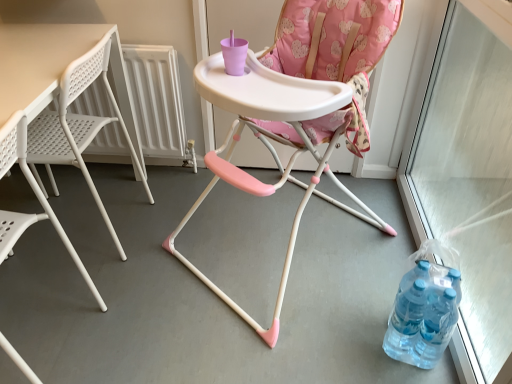
Question: In terms of size, does white plastic table at left appear bigger or smaller than white plastic radiator at left?

Choices:
 (A) small
 (B) big

Answer: (B)

Question: From the image's perspective, is white plastic table at left above or below white plastic radiator at left?

Choices:
 (A) below
 (B) above

Answer: (A)

Question: Based on their relative distances, which object is farther from the white plastic table at left?

Choices:
 (A) pink plastic highchair at center, positioned as the 1th chair in right-to-left order
 (B) transparent plastic screen door at right
 (C) translucent plastic bottles at lower right
 (D) white plastic chair at left, which appears as the first chair when viewed from the left
 (E) white plastic radiator at left

Answer: (B)

Question: Estimate the real-world distances between objects in this image. Which object is farther from the white plastic chair at left, the second chair when ordered from right to left?

Choices:
 (A) white plastic radiator at left
 (B) translucent plastic bottles at lower right
 (C) pink plastic highchair at center, the 2th chair from the left
 (D) white plastic table at left
 (E) transparent plastic screen door at right

Answer: (E)